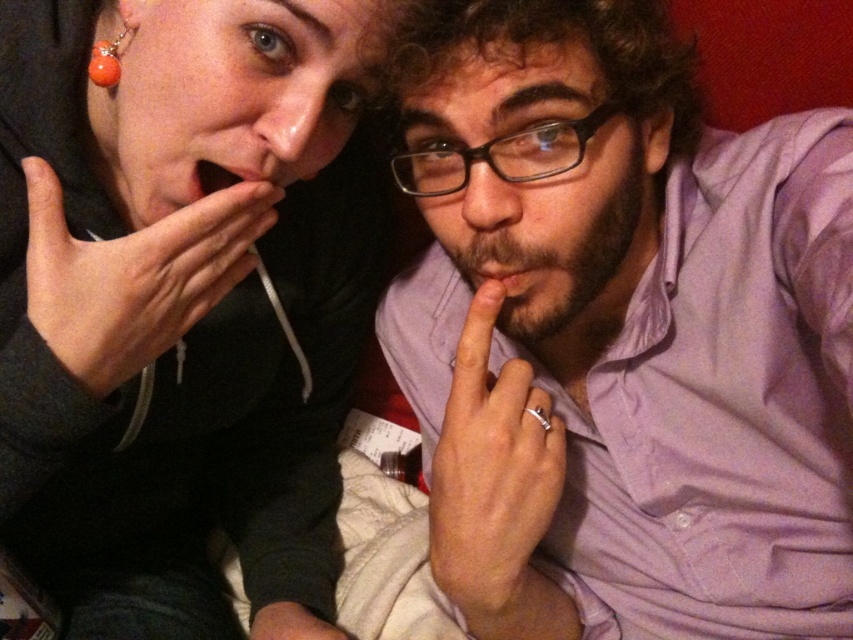
You are a photographer adjusting your camera settings. You notice the black plastic glasses at center and the matte black hand at lower center in the frame. Which object is covering the other?

The black plastic glasses at center is positioned over matte black hand at lower center, so the glasses are covering the hand.

You are designing a puzzle game where players must place objects in specific positions based on their sizes. In this scene, you need to place the matte black hand at lower center and the orange glass bead at upper left into two slots. The slot for the larger object is wider. Which object should go into the wider slot?

The matte black hand at lower center should go into the wider slot because its width is larger than the orange glass bead at upper left.